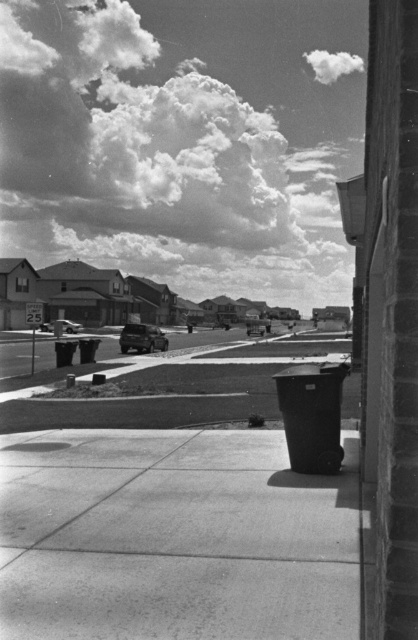
You are a delivery person trying to park your 1.5 meter tall delivery robot on the smooth concrete sidewalk at center. The shiny silver sedan at center is blocking part of the sidewalk. Can the robot fit under the sedan?

The smooth concrete sidewalk at center is not as tall as shiny silver sedan at center, so the robot can fit under the sedan since it is shorter than the sedan.

You are standing on a balcony and looking down at the street below. You see a smooth concrete sidewalk at center and a shiny silver sedan at center. Which object is closer to you?

The smooth concrete sidewalk at center is closer to the viewer than the shiny silver sedan at center.

You are a delivery person trying to park your shiny silver car at center on the smooth concrete sidewalk at center. Can your car fit on the sidewalk?

The smooth concrete sidewalk at center is shorter than the shiny silver car at center, so the car cannot fit on the sidewalk.